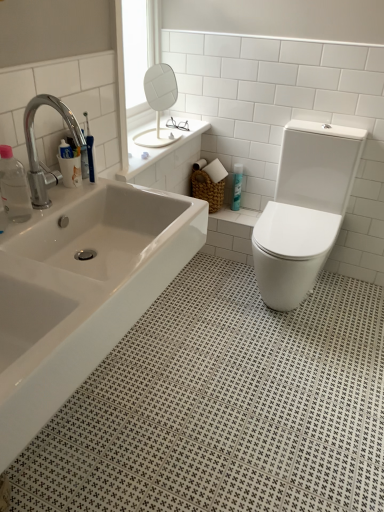
Question: Which direction should I rotate to face blue glossy spray can at center, marked as the first toiletry in a top-to-bottom arrangement, — up or down?

Choices:
 (A) down
 (B) up

Answer: (B)

Question: Can you confirm if transparent plastic bottle at left, the 1th toiletry positioned from the bottom, is positioned to the left of white glossy toilet at right?

Choices:
 (A) yes
 (B) no

Answer: (A)

Question: Does transparent plastic bottle at left, which is the first toiletry from front to back, touch white glossy toilet at right?

Choices:
 (A) yes
 (B) no

Answer: (B)

Question: Is transparent plastic bottle at left, positioned as the 2th toiletry in back-to-front order, bigger than white glossy toilet at right?

Choices:
 (A) no
 (B) yes

Answer: (A)

Question: Considering the relative sizes of transparent plastic bottle at left, which is the first toiletry from front to back, and white glossy toilet at right in the image provided, is transparent plastic bottle at left, which is the first toiletry from front to back, taller than white glossy toilet at right?

Choices:
 (A) no
 (B) yes

Answer: (A)

Question: Is transparent plastic bottle at left, which is the first toiletry from front to back, facing away from white glossy toilet at right?

Choices:
 (A) yes
 (B) no

Answer: (B)

Question: Is transparent plastic bottle at left, which is the first toiletry in left-to-right order, thinner than white glossy toilet at right?

Choices:
 (A) no
 (B) yes

Answer: (B)

Question: Is transparent plastic bottle at left, which is the first toiletry from front to back, at the back of white glossy bathtub at center?

Choices:
 (A) yes
 (B) no

Answer: (B)

Question: Is white glossy bathtub at center to the left of transparent plastic bottle at left, acting as the second toiletry starting from the right, from the viewer's perspective?

Choices:
 (A) yes
 (B) no

Answer: (B)

Question: Are white glossy bathtub at center and transparent plastic bottle at left, the second toiletry positioned from the top, located far from each other?

Choices:
 (A) yes
 (B) no

Answer: (B)

Question: From the image's perspective, would you say white glossy bathtub at center is shown under transparent plastic bottle at left, positioned as the 2th toiletry in back-to-front order?

Choices:
 (A) yes
 (B) no

Answer: (A)

Question: Is white glossy bathtub at center further to camera compared to transparent plastic bottle at left, positioned as the 2th toiletry in back-to-front order?

Choices:
 (A) no
 (B) yes

Answer: (A)

Question: Considering the relative positions of white glossy bathtub at center and transparent plastic bottle at left, which is the first toiletry in left-to-right order, in the image provided, is white glossy bathtub at center to the right of transparent plastic bottle at left, which is the first toiletry in left-to-right order, from the viewer's perspective?

Choices:
 (A) no
 (B) yes

Answer: (B)

Question: Does white glossy bathtub at center have a lesser width compared to chrome metallic faucet at upper left?

Choices:
 (A) yes
 (B) no

Answer: (B)